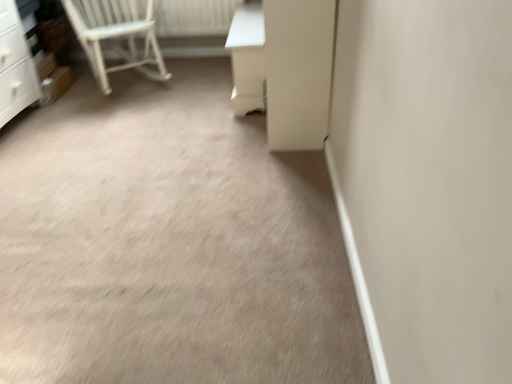
Describe the element at coordinates (247, 59) in the screenshot. I see `white glossy vanity at upper right` at that location.

This screenshot has height=384, width=512. Describe the element at coordinates (115, 36) in the screenshot. I see `white wooden chair at upper left` at that location.

Describe the element at coordinates (169, 243) in the screenshot. This screenshot has width=512, height=384. I see `beige carpet at center` at that location.

Identify the location of white glossy vanity at upper right. The width and height of the screenshot is (512, 384). (247, 59).

How different are the orientations of white wooden chair at upper left and white glossy screen door at center in degrees?

There is a 124-degree angle between the facing directions of white wooden chair at upper left and white glossy screen door at center.

Are white wooden chair at upper left and white glossy screen door at center located far from each other?

white wooden chair at upper left is positioned a significant distance from white glossy screen door at center.

From the image's perspective, is white wooden chair at upper left located above or below white glossy screen door at center?

Based on their image positions, white wooden chair at upper left is located above white glossy screen door at center.

The image size is (512, 384). Find the location of `chair in front of the white painted wood radiator at upper left`. chair in front of the white painted wood radiator at upper left is located at coordinates (115, 36).

From the image's perspective, is white painted wood radiator at upper left positioned above or below white wooden chair at upper left?

From the image's perspective, white painted wood radiator at upper left appears above white wooden chair at upper left.

In terms of width, does white painted wood radiator at upper left look wider or thinner when compared to white wooden chair at upper left?

white painted wood radiator at upper left is thinner than white wooden chair at upper left.

Is white painted wood radiator at upper left aimed at white wooden chair at upper left?

Yes, white painted wood radiator at upper left is facing white wooden chair at upper left.

From a real-world perspective, is white wooden chair at upper left under beige carpet at center?

No.

Can you confirm if white wooden chair at upper left is wider than beige carpet at center?

No.

Between white wooden chair at upper left and beige carpet at center, which one appears on the right side from the viewer's perspective?

beige carpet at center.

What's the angular difference between white wooden chair at upper left and beige carpet at center's facing directions?

The angle between the facing direction of white wooden chair at upper left and the facing direction of beige carpet at center is 34 degrees.

Is white glossy vanity at upper right taller or shorter than white glossy screen door at center?

white glossy vanity at upper right is shorter than white glossy screen door at center.

Looking at this image, which object is positioned more to the left, white glossy vanity at upper right or white glossy screen door at center?

Positioned to the left is white glossy vanity at upper right.

Identify the location of vanity behind the white glossy screen door at center. The image size is (512, 384). (247, 59).

Is point (232, 53) closer to camera compared to point (322, 37)?

No, (232, 53) is further to viewer.

Which object is closer to the camera taking this photo, beige carpet at center or white painted wood radiator at upper left?

Positioned in front is beige carpet at center.

Considering the relative sizes of beige carpet at center and white painted wood radiator at upper left in the image provided, is beige carpet at center shorter than white painted wood radiator at upper left?

Yes, beige carpet at center is shorter than white painted wood radiator at upper left.

Is point (152, 322) farther from viewer compared to point (169, 24)?

No, it is not.

From the image's perspective, which one is positioned higher, white glossy vanity at upper right or white wooden chair at upper left?

white wooden chair at upper left appears higher in the image.

Is white glossy vanity at upper right facing towards white wooden chair at upper left?

Yes.

Visually, is white glossy vanity at upper right positioned to the left or to the right of white wooden chair at upper left?

From the image, it's evident that white glossy vanity at upper right is to the right of white wooden chair at upper left.

Based on the photo, is beige carpet at center shorter than white glossy screen door at center?

Yes, beige carpet at center is shorter than white glossy screen door at center.

Can you confirm if beige carpet at center is positioned to the left of white glossy screen door at center?

Indeed, beige carpet at center is positioned on the left side of white glossy screen door at center.

Considering the sizes of beige carpet at center and white glossy screen door at center in the image, is beige carpet at center wider or thinner than white glossy screen door at center?

Considering their sizes, beige carpet at center looks broader than white glossy screen door at center.

The width and height of the screenshot is (512, 384). In order to click on screen door on the right of the white wooden chair at upper left in this screenshot , I will do `click(298, 72)`.

This screenshot has width=512, height=384. I want to click on radiator above the white wooden chair at upper left (from the image's perspective), so click(193, 17).

Looking at the image, which one is located further to white glossy vanity at upper right, white painted wood radiator at upper left or white wooden chair at upper left?

white wooden chair at upper left is further to white glossy vanity at upper right.

When comparing their distances from white painted wood radiator at upper left, does beige carpet at center or white glossy vanity at upper right seem closer?

white glossy vanity at upper right.

When comparing their distances from white wooden chair at upper left, does beige carpet at center or white glossy vanity at upper right seem further?

The object further to white wooden chair at upper left is beige carpet at center.

Which object lies further to the anchor point white glossy screen door at center, white glossy vanity at upper right or beige carpet at center?

The object further to white glossy screen door at center is beige carpet at center.

From the image, which object appears to be farther from beige carpet at center, white glossy vanity at upper right or white wooden chair at upper left?

white wooden chair at upper left lies further to beige carpet at center than the other object.

When comparing their distances from beige carpet at center, does white painted wood radiator at upper left or white glossy screen door at center seem further?

white painted wood radiator at upper left is further to beige carpet at center.

Estimate the real-world distances between objects in this image. Which object is further from white glossy screen door at center, white wooden chair at upper left or beige carpet at center?

white wooden chair at upper left lies further to white glossy screen door at center than the other object.

Considering their positions, is white glossy vanity at upper right positioned further to white wooden chair at upper left than white painted wood radiator at upper left?

white glossy vanity at upper right is further to white wooden chair at upper left.

Find the location of `chair positioned between white glossy screen door at center and white painted wood radiator at upper left from near to far`. chair positioned between white glossy screen door at center and white painted wood radiator at upper left from near to far is located at coordinates (115, 36).

In order to click on radiator between white wooden chair at upper left and white glossy vanity at upper right from left to right in this screenshot , I will do `click(193, 17)`.

Locate an element on the screen. vanity situated between white wooden chair at upper left and white glossy screen door at center from left to right is located at coordinates (247, 59).

I want to click on screen door between beige carpet at center and white wooden chair at upper left in the front-back direction, so click(298, 72).